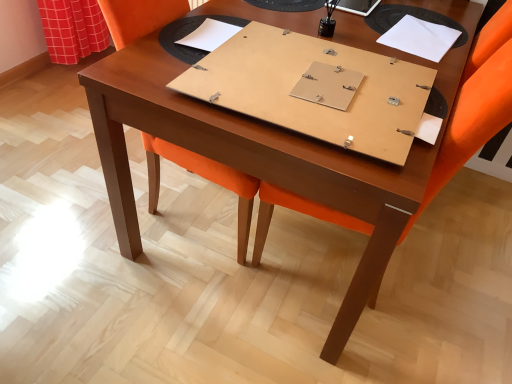
Question: From a real-world perspective, is white paper at upper right, acting as the 3th notebook starting from the left, physically above white cardboard notebook at upper center, placed as the 3th notebook when sorted from right to left?

Choices:
 (A) no
 (B) yes

Answer: (A)

Question: Is white paper at upper right, which is the 1th notebook from right to left, oriented towards white cardboard notebook at upper center, marked as the first notebook in a left-to-right arrangement?

Choices:
 (A) yes
 (B) no

Answer: (B)

Question: Is white paper at upper right, acting as the 3th notebook starting from the left, smaller than white cardboard notebook at upper center, marked as the first notebook in a left-to-right arrangement?

Choices:
 (A) yes
 (B) no

Answer: (B)

Question: Is white paper at upper right, which is the 1th notebook from right to left, positioned behind white cardboard notebook at upper center, placed as the 3th notebook when sorted from right to left?

Choices:
 (A) no
 (B) yes

Answer: (B)

Question: Can you confirm if white paper at upper right, which is the 1th notebook from right to left, is thinner than white cardboard notebook at upper center, marked as the first notebook in a left-to-right arrangement?

Choices:
 (A) yes
 (B) no

Answer: (B)

Question: Can white cardboard notebook at upper center, marked as the first notebook in a left-to-right arrangement, be found inside white paper at upper right, acting as the 3th notebook starting from the left?

Choices:
 (A) yes
 (B) no

Answer: (B)

Question: Is matte wood notebook at center, positioned as the 2th notebook in right-to-left order, looking in the opposite direction of white cardboard notebook at upper center, marked as the first notebook in a left-to-right arrangement?

Choices:
 (A) yes
 (B) no

Answer: (B)

Question: Does matte wood notebook at center, positioned as the 2th notebook in right-to-left order, come behind white cardboard notebook at upper center, placed as the 3th notebook when sorted from right to left?

Choices:
 (A) yes
 (B) no

Answer: (B)

Question: Would you consider matte wood notebook at center, positioned as the 2th notebook in right-to-left order, to be distant from white cardboard notebook at upper center, marked as the first notebook in a left-to-right arrangement?

Choices:
 (A) yes
 (B) no

Answer: (B)

Question: Considering the relative sizes of matte wood notebook at center, positioned as the 2th notebook in right-to-left order, and white cardboard notebook at upper center, placed as the 3th notebook when sorted from right to left, in the image provided, is matte wood notebook at center, positioned as the 2th notebook in right-to-left order, shorter than white cardboard notebook at upper center, placed as the 3th notebook when sorted from right to left,?

Choices:
 (A) no
 (B) yes

Answer: (A)

Question: Can you confirm if matte wood notebook at center, positioned as the 2th notebook in right-to-left order, is positioned to the right of white cardboard notebook at upper center, marked as the first notebook in a left-to-right arrangement?

Choices:
 (A) yes
 (B) no

Answer: (A)

Question: Does matte wood notebook at center, positioned as the 2th notebook in right-to-left order, have a larger size compared to white cardboard notebook at upper center, marked as the first notebook in a left-to-right arrangement?

Choices:
 (A) no
 (B) yes

Answer: (B)

Question: Is the surface of orange fabric swivel chair at center in direct contact with white paper at upper right, acting as the 3th notebook starting from the left?

Choices:
 (A) yes
 (B) no

Answer: (B)